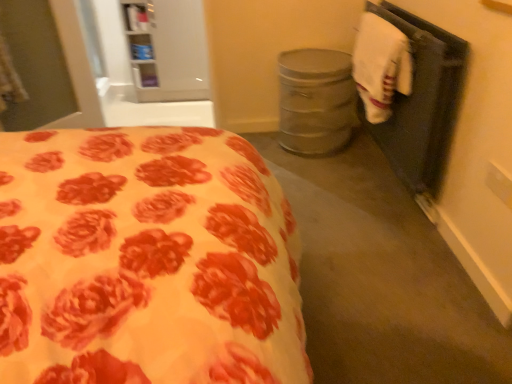
Where is `vacant space situated on the left part of white fabric at right`? Image resolution: width=512 pixels, height=384 pixels. vacant space situated on the left part of white fabric at right is located at coordinates (328, 179).